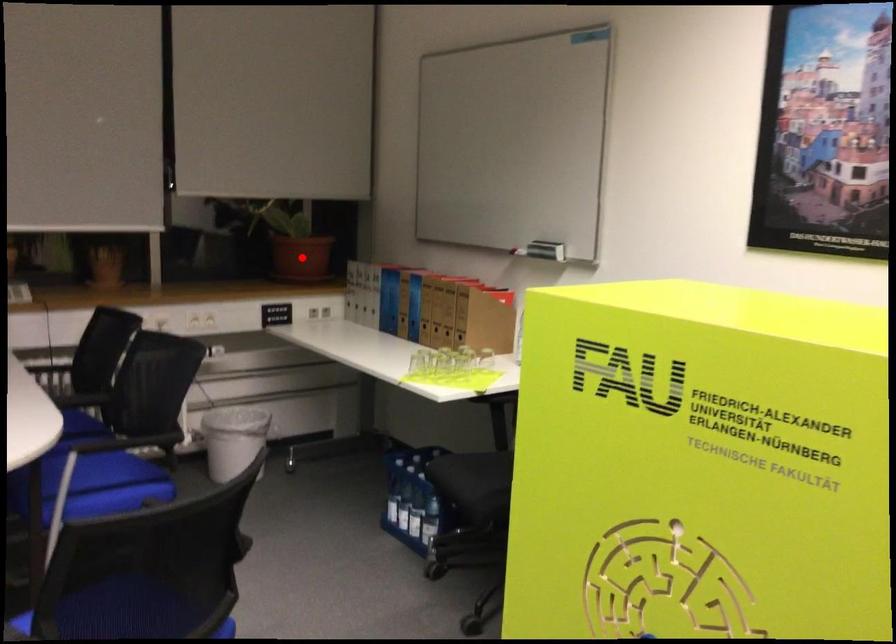
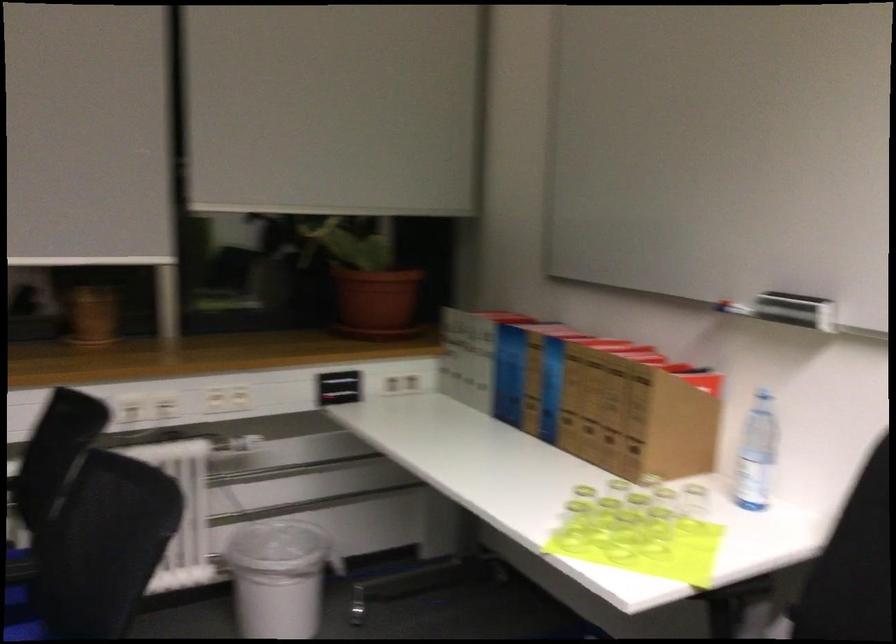
Question: I am providing you with two images of the same scene from different viewpoints. Image1 has a red point marked. In image2, the corresponding 3D location appears at what relative position? Reply with the corresponding letter.

Choices:
 (A) Closer
 (B) Farther

Answer: (A)